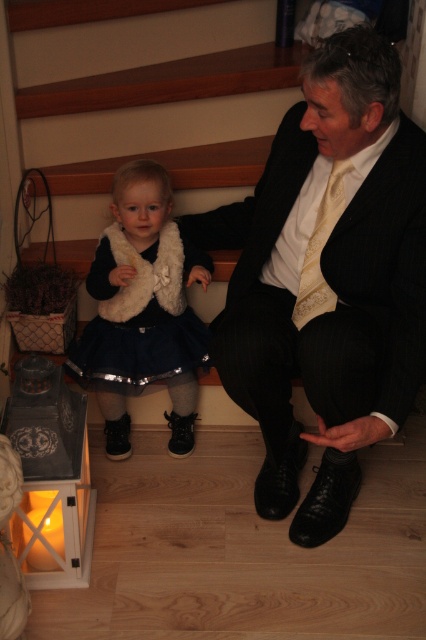
You are a photographer taking a closeup shot of the two objects at the center of the image. The matte black suit at center and the yellow textured tie at center. Which object will appear larger in your photo?

The matte black suit at center will appear larger in the photo because it is closer to the viewer than the yellow textured tie at center.

Looking at this image, you are a photographer standing at the camera position. You want to place a small prop at the point labeled point (354, 490) so that it appears in the foreground of the image. Given that the prop is 1.5 meters tall, will it block the view of the adult male in the scene?

The point labeled point (354, 490) is 1.77 meters away from the camera. Since the prop is 1.5 meters tall, placing it at this point would mean the prop is closer to the camera than the adult male. However, the prop is shorter than the distance from the camera, so it might not fully block the view. But since the prop is placed in the foreground, it could partially obscure parts of the adult male depending on its placement. However, based on the given information, the prop is 1.5 meters tall and placed 1.77

You are a photographer setting up a shoot in this scene. You need to place a small reflector to bounce light onto the navy blue satin dress at lower left without illuminating the matte black suit at center. Based on their positions, where should you position the reflector relative to the dress?

The matte black suit at center is located above the navy blue satin dress at lower left, so placing the reflector below the dress would direct light upward toward the dress while avoiding the suit above.